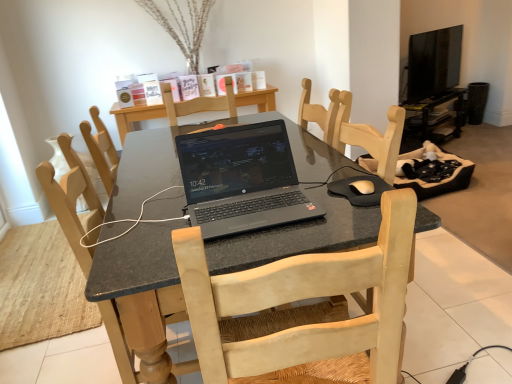
Measure the distance between point (426, 116) and camera.

Point (426, 116) and camera are 12.98 feet apart from each other.

Image resolution: width=512 pixels, height=384 pixels. What do you see at coordinates (358, 193) in the screenshot?
I see `black rubber mousepad at center` at bounding box center [358, 193].

At what (x,y) coordinates should I click in order to perform the action: click on light wood chair at center. Please return your answer as a coordinate pair (x, y). Looking at the image, I should click on (72, 206).

At what (x,y) coordinates should I click in order to perform the action: click on black granite desk at center. Please return your answer as a coordinate pair (x, y). Looking at the image, I should click on (138, 301).

Is light wood chair at center bigger than black matte laptop at center?

Indeed, light wood chair at center has a larger size compared to black matte laptop at center.

Is light wood chair at center with black matte laptop at center?

No, light wood chair at center is not touching black matte laptop at center.

From the image's perspective, would you say light wood chair at center is positioned over black matte laptop at center?

No, from the image's perspective, light wood chair at center is not above black matte laptop at center.

From the image's perspective, which one is positioned lower, black matte laptop at center or light wood chair at center?

light wood chair at center is shown below in the image.

Considering the relative positions of black matte laptop at center and light wood chair at center in the image provided, is black matte laptop at center to the left or to the right of light wood chair at center?

Clearly, black matte laptop at center is on the right of light wood chair at center in the image.

From a real-world perspective, is black matte laptop at center positioned above or below light wood chair at center?

Clearly, from a real-world perspective, black matte laptop at center is above light wood chair at center.

Does black glossy tv at upper right come in front of black matte laptop at center?

No, black glossy tv at upper right is further to the viewer.

Is black glossy tv at upper right looking in the opposite direction of black matte laptop at center?

No.

From the image's perspective, between black glossy tv at upper right and black matte laptop at center, who is located below?

From the image's view, black matte laptop at center is below.

Who is smaller, black glossy tv at upper right or black matte laptop at center?

With smaller size is black matte laptop at center.

Can you tell me how much black glossy tv at upper right and black glossy computer desk at upper right differ in facing direction?

The angular difference between black glossy tv at upper right and black glossy computer desk at upper right is 0.00201 degrees.

From the image's perspective, between black glossy tv at upper right and black glossy computer desk at upper right, which one is located above?

black glossy tv at upper right is shown above in the image.

Does black glossy tv at upper right have a lesser height compared to black glossy computer desk at upper right?

In fact, black glossy tv at upper right may be taller than black glossy computer desk at upper right.

Is black glossy tv at upper right oriented away from black glossy computer desk at upper right?

No, black glossy tv at upper right's orientation is not away from black glossy computer desk at upper right.

Considering the sizes of black granite desk at center and black glossy tv at upper right in the image, is black granite desk at center taller or shorter than black glossy tv at upper right?

Considering their sizes, black granite desk at center has more height than black glossy tv at upper right.

From the image's perspective, between black granite desk at center and black glossy tv at upper right, which one is located above?

black glossy tv at upper right, from the image's perspective.

Does point (93, 234) come closer to viewer compared to point (455, 44)?

Yes, it is.

Would you say black granite desk at center is inside or outside black glossy tv at upper right?

black granite desk at center cannot be found inside black glossy tv at upper right.

Considering the sizes of objects black matte laptop at center and black rubber mousepad at center in the image provided, who is taller, black matte laptop at center or black rubber mousepad at center?

Standing taller between the two is black matte laptop at center.

Are black matte laptop at center and black rubber mousepad at center located far from each other?

That's not correct — black matte laptop at center is a little close to black rubber mousepad at center.

Which is nearer, (246, 167) or (345, 190)?

The point (345, 190) is more forward.

Is black granite desk at center oriented away from black rubber mousepad at center?

black granite desk at center is not turned away from black rubber mousepad at center.

Is black granite desk at center bigger than black rubber mousepad at center?

Yes.

Relative to black rubber mousepad at center, is black granite desk at center in front or behind?

Clearly, black granite desk at center is in front of black rubber mousepad at center.

At what (x,y) coordinates should I click in order to perform the action: click on chair on the left of the black matte laptop at center. Please return your answer as a coordinate pair (x, y). The width and height of the screenshot is (512, 384). Looking at the image, I should click on (72, 206).

The height and width of the screenshot is (384, 512). Find the location of `laptop above the light wood chair at center (from a real-world perspective)`. laptop above the light wood chair at center (from a real-world perspective) is located at coordinates (241, 179).

Looking at the image, which one is located closer to light wood chair at center, black granite desk at center or black matte laptop at center?

Among the two, black granite desk at center is located nearer to light wood chair at center.

From the image, which object appears to be farther from black rubber mousepad at center, black glossy tv at upper right or black granite desk at center?

black glossy tv at upper right is positioned further to the anchor black rubber mousepad at center.

Considering their positions, is black rubber mousepad at center positioned further to light wood chair at center than black glossy computer desk at upper right?

Among the two, black glossy computer desk at upper right is located further to light wood chair at center.

From the picture: From the image, which object appears to be farther from black glossy computer desk at upper right, black glossy tv at upper right or black rubber mousepad at center?

black rubber mousepad at center is positioned further to the anchor black glossy computer desk at upper right.

Looking at the image, which one is located closer to light wood chair at center, black glossy tv at upper right or black rubber mousepad at center?

The object closer to light wood chair at center is black rubber mousepad at center.

From the image, which object appears to be nearer to black glossy computer desk at upper right, black granite desk at center or black matte laptop at center?

The object closer to black glossy computer desk at upper right is black granite desk at center.

From the image, which object appears to be farther from black glossy tv at upper right, black matte laptop at center or black glossy computer desk at upper right?

black matte laptop at center is further to black glossy tv at upper right.

Looking at the image, which one is located further to black granite desk at center, black glossy tv at upper right or black matte laptop at center?

The object further to black granite desk at center is black glossy tv at upper right.

The width and height of the screenshot is (512, 384). Identify the location of desk between light wood chair at center and black rubber mousepad at center. (138, 301).

I want to click on laptop between black granite desk at center and black rubber mousepad at center from left to right, so click(241, 179).

I want to click on laptop between black granite desk at center and black glossy computer desk at upper right along the z-axis, so click(x=241, y=179).

Where is `mousepad located between black granite desk at center and black glossy tv at upper right in the depth direction`? mousepad located between black granite desk at center and black glossy tv at upper right in the depth direction is located at coordinates (358, 193).